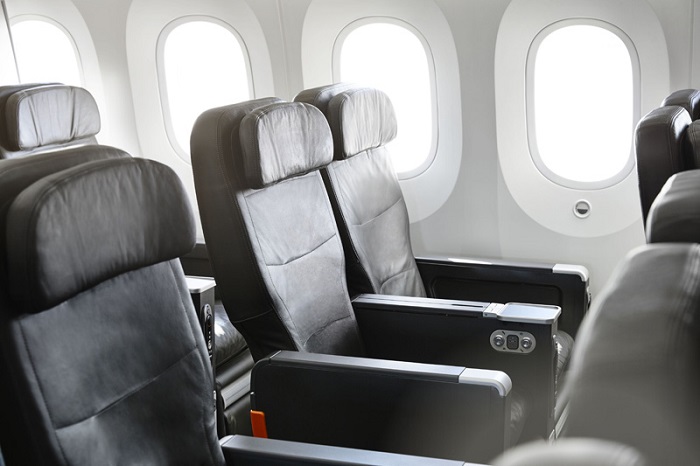
This screenshot has height=466, width=700. In order to click on windows in this screenshot , I will do `click(52, 60)`, `click(180, 78)`, `click(364, 77)`, `click(577, 78)`.